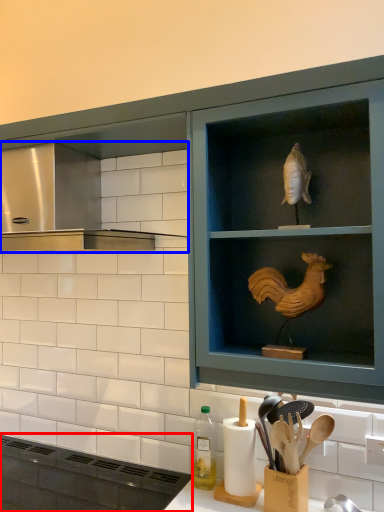
Question: Which of the following is the farthest to the observer, appliance (highlighted by a red box) or vent (highlighted by a blue box)?

Choices:
 (A) appliance
 (B) vent

Answer: (B)